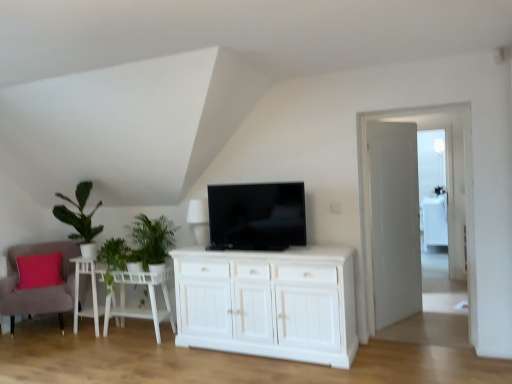
This screenshot has width=512, height=384. Identify the location of vacant space in front of white wooden door at right. pyautogui.click(x=419, y=330).